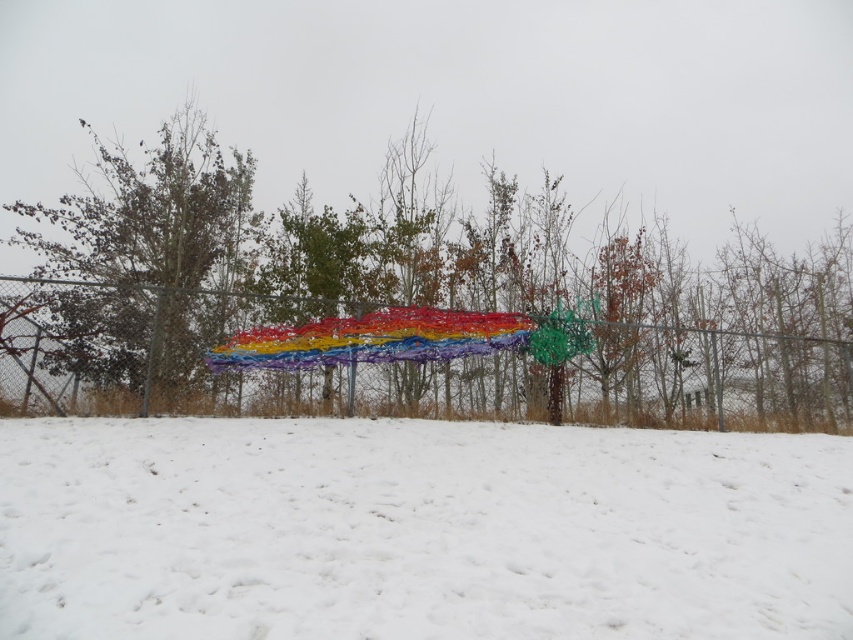
Question: Which point is closer to the camera taking this photo?

Choices:
 (A) (289, 381)
 (B) (428, 624)
 (C) (207, 355)

Answer: (B)

Question: From the image, what is the correct spatial relationship of white fluffy snow at lower center in relation to rainbow fabric blanket at center?

Choices:
 (A) below
 (B) above

Answer: (A)

Question: From the image, what is the correct spatial relationship of brown textured tree at left in relation to rainbow fabric blanket at center?

Choices:
 (A) above
 (B) below

Answer: (A)

Question: Can you confirm if brown textured tree at left is positioned to the left of rainbow fabric blanket at center?

Choices:
 (A) yes
 (B) no

Answer: (A)

Question: Which object appears farthest from the camera in this image?

Choices:
 (A) multicolored wire sculpture at center
 (B) brown textured tree at left
 (C) white fluffy snow at lower center
 (D) rainbow fabric blanket at center

Answer: (B)

Question: Which object appears farthest from the camera in this image?

Choices:
 (A) rainbow fabric blanket at center
 (B) brown textured tree at left

Answer: (B)